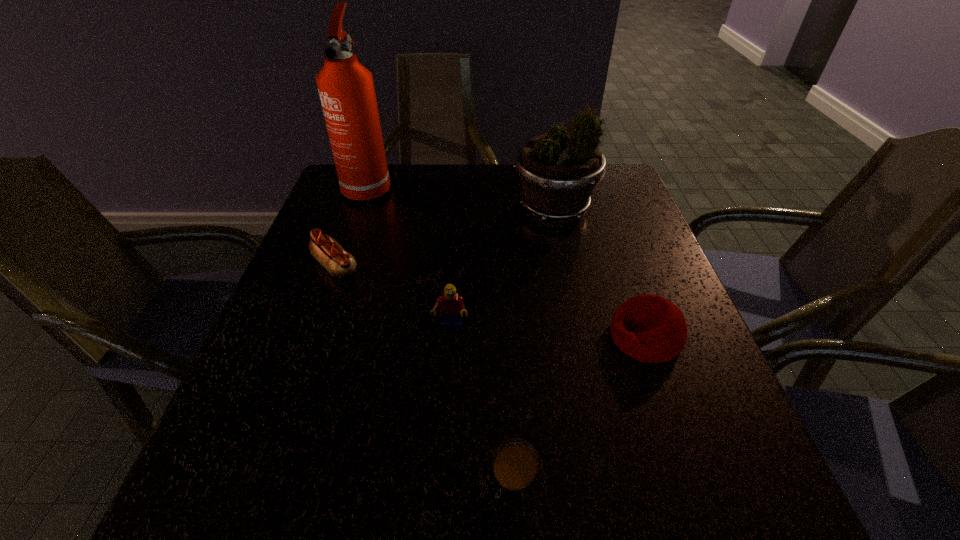
Locate an element on the screen. The image size is (960, 540). free spot between the cappuccino and the second tallest object is located at coordinates (x=534, y=345).

Where is `object that stands as the fifth closest to the Lego`? The width and height of the screenshot is (960, 540). object that stands as the fifth closest to the Lego is located at coordinates (346, 89).

Identify which object is the third closest to the sausage. Please provide its 2D coordinates. Your answer should be formatted as a tuple, i.e. [(x, y)], where the tuple contains the x and y coordinates of a point satisfying the conditions above.

[(558, 172)]

This screenshot has width=960, height=540. Find the location of `free region that satisfies the following two spatial constraints: 1. on the front side of the nearest object; 2. on the left side of the sausage`. free region that satisfies the following two spatial constraints: 1. on the front side of the nearest object; 2. on the left side of the sausage is located at coordinates (259, 479).

This screenshot has height=540, width=960. I want to click on free space in the image that satisfies the following two spatial constraints: 1. on the front side of the nearest object; 2. on the right side of the sausage, so click(259, 479).